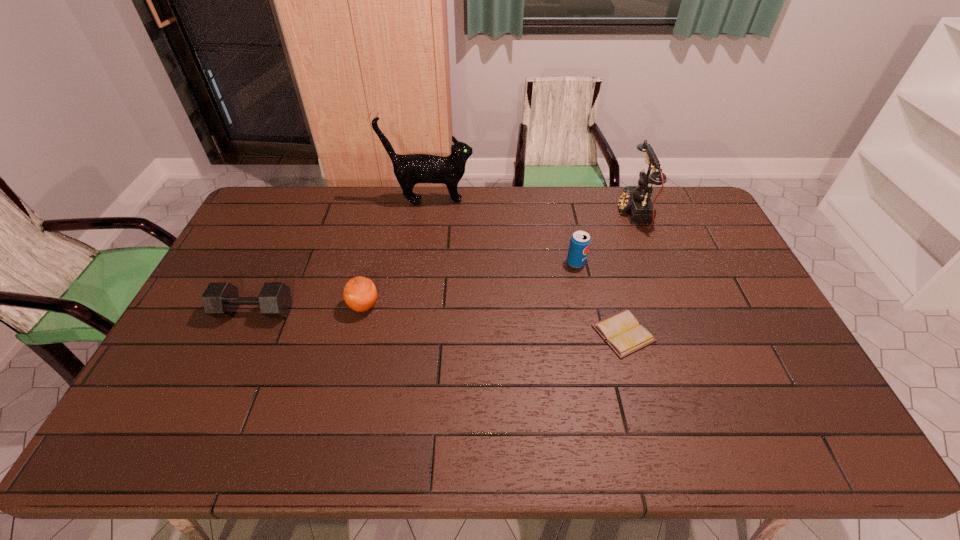
What are the coordinates of `cat` in the screenshot? It's located at (411, 169).

At what (x,y) coordinates should I click in order to perform the action: click on the second tallest object. Please return your answer as a coordinate pair (x, y). Looking at the image, I should click on [635, 200].

The height and width of the screenshot is (540, 960). Find the location of `telephone`. telephone is located at coordinates (635, 200).

Identify the location of the fourth nearest object. (580, 241).

Locate an element on the screen. This screenshot has height=540, width=960. orange is located at coordinates (360, 294).

Identify the location of the leftmost object. (221, 299).

Where is `the shortest object`? Image resolution: width=960 pixels, height=540 pixels. the shortest object is located at coordinates (622, 331).

Locate an element on the screen. This screenshot has width=960, height=540. vacant space located 0.180m on the face of the cat is located at coordinates click(x=521, y=201).

Where is `blank area located on the dial of the rightmost object`? blank area located on the dial of the rightmost object is located at coordinates (603, 213).

Where is `free spot located 0.220m on the dial of the rightmost object`? Image resolution: width=960 pixels, height=540 pixels. free spot located 0.220m on the dial of the rightmost object is located at coordinates (559, 213).